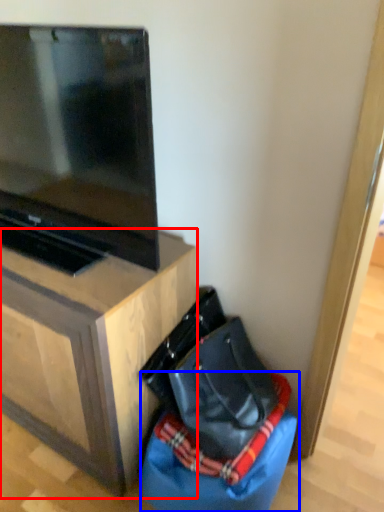
Question: Which object is further to the camera taking this photo, furniture (highlighted by a red box) or bean bag chair (highlighted by a blue box)?

Choices:
 (A) furniture
 (B) bean bag chair

Answer: (B)